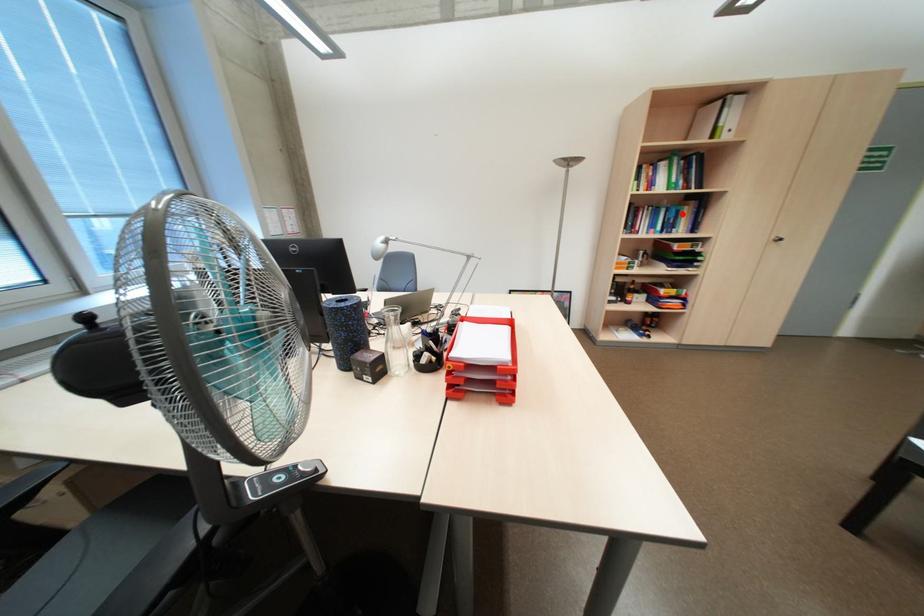
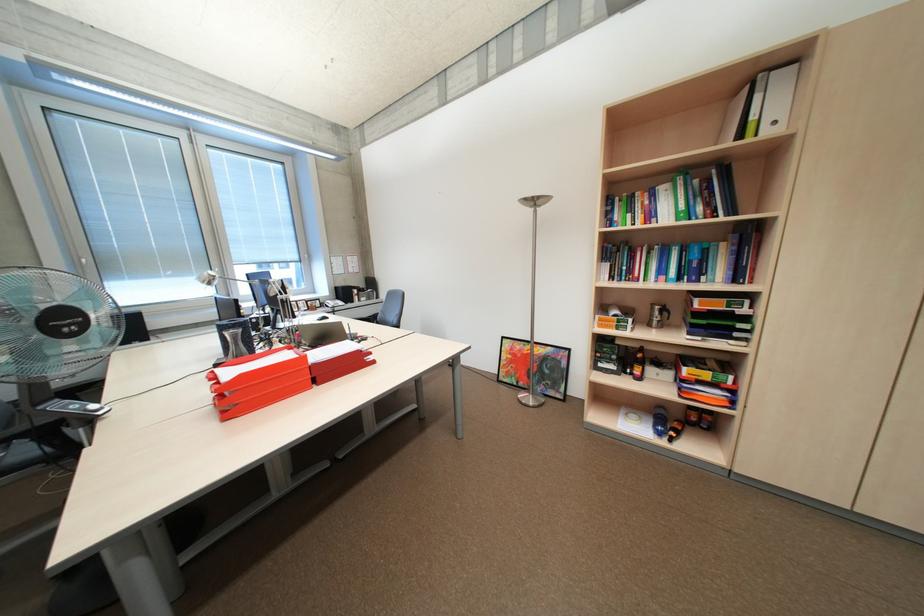
Find the pixel in the second image that matches the highlighted location in the first image.

(704, 254)